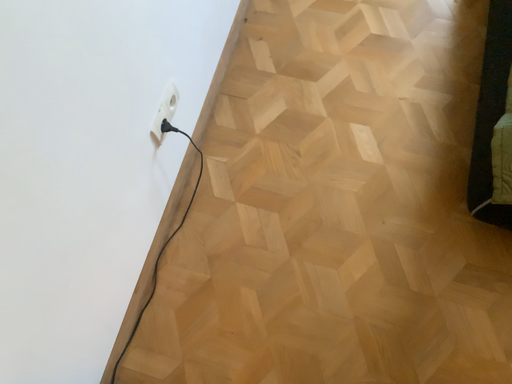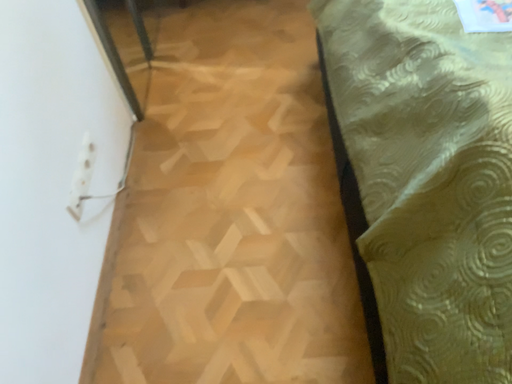
Question: Which way did the camera rotate in the video?

Choices:
 (A) rotated downward
 (B) rotated upward

Answer: (B)